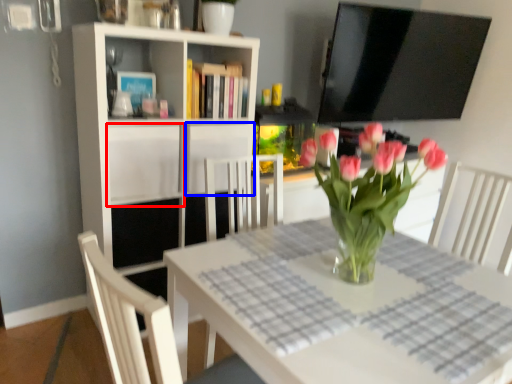
Question: Among these objects, which one is nearest to the camera, cabinet (highlighted by a red box) or cabinet (highlighted by a blue box)?

Choices:
 (A) cabinet
 (B) cabinet

Answer: (A)